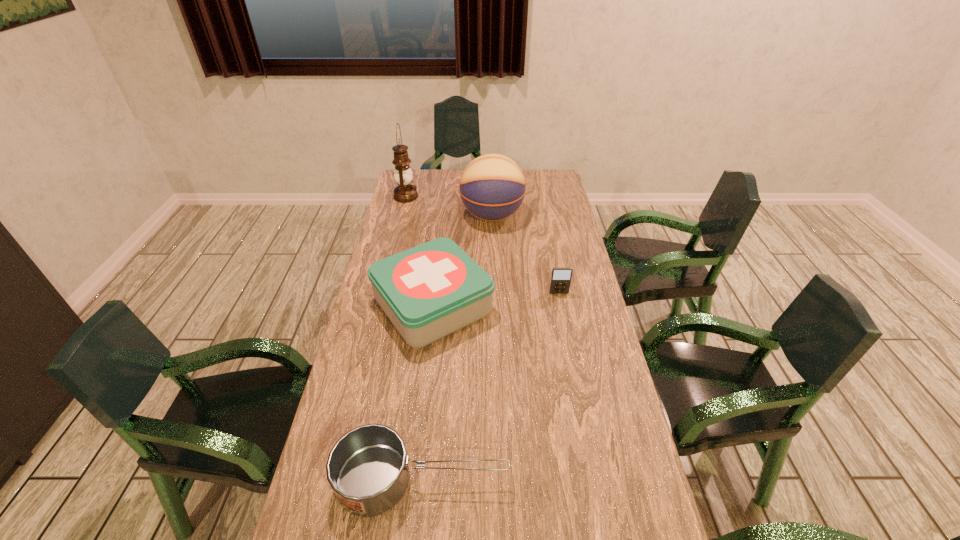
This screenshot has width=960, height=540. In the image, there is a desktop. What are the coordinates of `vacant space at the far left corner` in the screenshot? It's located at (420, 174).

The height and width of the screenshot is (540, 960). What are the coordinates of `free space between the nearest object and the third tallest object` in the screenshot? It's located at (427, 393).

Image resolution: width=960 pixels, height=540 pixels. Find the location of `free spot between the iPod and the nearest object`. free spot between the iPod and the nearest object is located at coordinates (491, 387).

At what (x,y) coordinates should I click in order to perform the action: click on free space between the rightmost object and the basketball. Please return your answer as a coordinate pair (x, y). Image resolution: width=960 pixels, height=540 pixels. Looking at the image, I should click on (525, 254).

Find the location of a particular element. vacant area between the tallest object and the second tallest object is located at coordinates (449, 206).

You are a GUI agent. You are given a task and a screenshot of the screen. Output one action in this format:
    pyautogui.click(x=<x>, y=<y>)
    Task: Click on the object that is the third closest to the second tallest object
    
    Given the screenshot: What is the action you would take?
    pyautogui.click(x=560, y=282)

At what (x,y) coordinates should I click in order to perform the action: click on the fourth closest object to the fourth shortest object. Please return your answer as a coordinate pair (x, y). The image size is (960, 540). Looking at the image, I should click on (367, 468).

I want to click on vacant point that satisfies the following two spatial constraints: 1. on the front-facing side of the rightmost object; 2. with the handle extending from one side of the saucepan, so click(596, 480).

I want to click on vacant space that satisfies the following two spatial constraints: 1. on the front-facing side of the iPod; 2. with the handle extending from one side of the nearest object, so click(x=596, y=480).